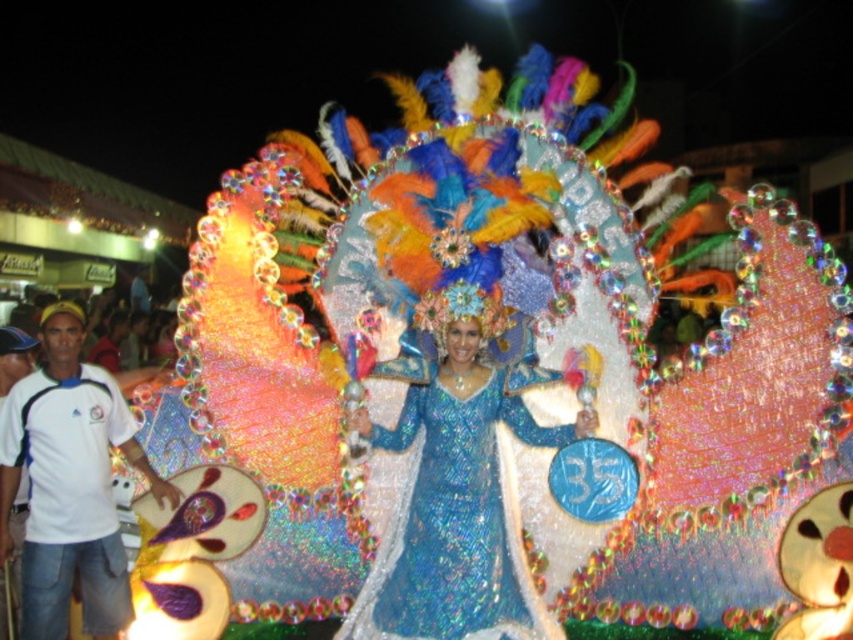
Question: Can you confirm if shiny blue dress at center is thinner than white cotton shirt at lower left?

Choices:
 (A) no
 (B) yes

Answer: (A)

Question: Among these points, which one is farthest from the camera?

Choices:
 (A) (372, 628)
 (B) (68, 317)

Answer: (B)

Question: Which point is farther to the camera?

Choices:
 (A) (1, 592)
 (B) (25, 545)

Answer: (A)

Question: Does shiny blue dress at center appear over white cotton shirt at left?

Choices:
 (A) yes
 (B) no

Answer: (B)

Question: Which of these objects is positioned closest to the shiny blue dress at center?

Choices:
 (A) white cotton shirt at left
 (B) white cotton shirt at lower left

Answer: (B)

Question: In this image, where is shiny blue dress at center located relative to white cotton shirt at left?

Choices:
 (A) right
 (B) left

Answer: (A)